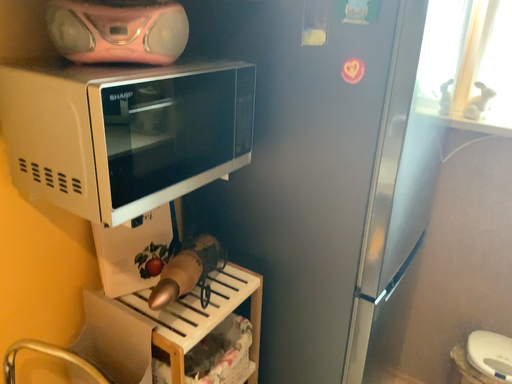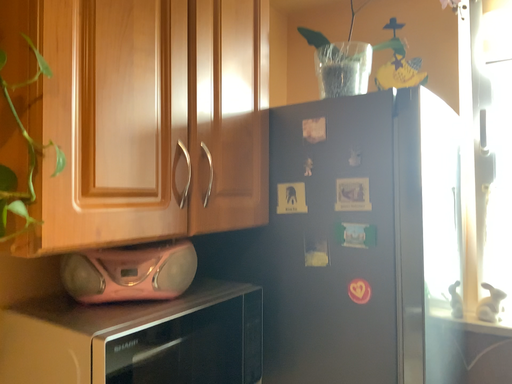
Question: Which way did the camera rotate in the video?

Choices:
 (A) rotated upward
 (B) rotated downward

Answer: (A)